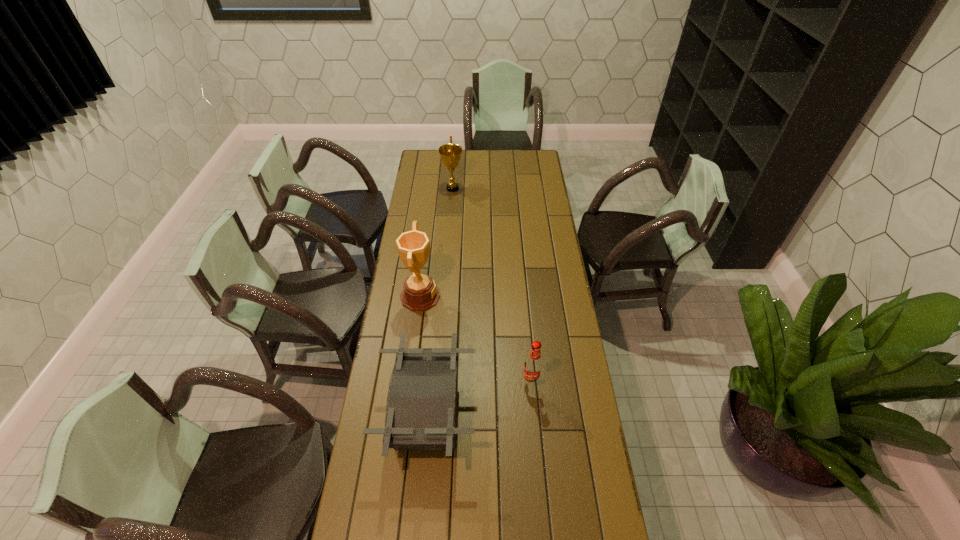
Where is `award that is at the left edge`? Image resolution: width=960 pixels, height=540 pixels. award that is at the left edge is located at coordinates (420, 293).

You are a GUI agent. You are given a task and a screenshot of the screen. Output one action in this format:
    pyautogui.click(x=<x>, y=<y>)
    Task: Click on the drone that is positioned at the left edge
    The width and height of the screenshot is (960, 540).
    Given the screenshot: What is the action you would take?
    pyautogui.click(x=421, y=409)

In the image, there is a desktop. What are the coordinates of `vacant area at the left edge` in the screenshot? It's located at (389, 377).

Where is `free space at the right edge of the desktop`? This screenshot has height=540, width=960. free space at the right edge of the desktop is located at coordinates (549, 411).

Find the location of a particular element. The width and height of the screenshot is (960, 540). free spot between the drone and the third tallest object is located at coordinates (479, 399).

This screenshot has width=960, height=540. I want to click on unoccupied position between the farthest object and the second shortest object, so click(x=492, y=285).

Locate an element on the screen. The height and width of the screenshot is (540, 960). free space that is in between the drone and the rightmost object is located at coordinates (479, 399).

Locate an element on the screen. The width and height of the screenshot is (960, 540). vacant space in between the second farthest object and the third tallest object is located at coordinates (476, 339).

Locate an element on the screen. This screenshot has width=960, height=540. vacant area that lies between the drone and the second tallest object is located at coordinates (441, 302).

Where is `vacant region between the second farthest object and the root beer`? The width and height of the screenshot is (960, 540). vacant region between the second farthest object and the root beer is located at coordinates (476, 339).